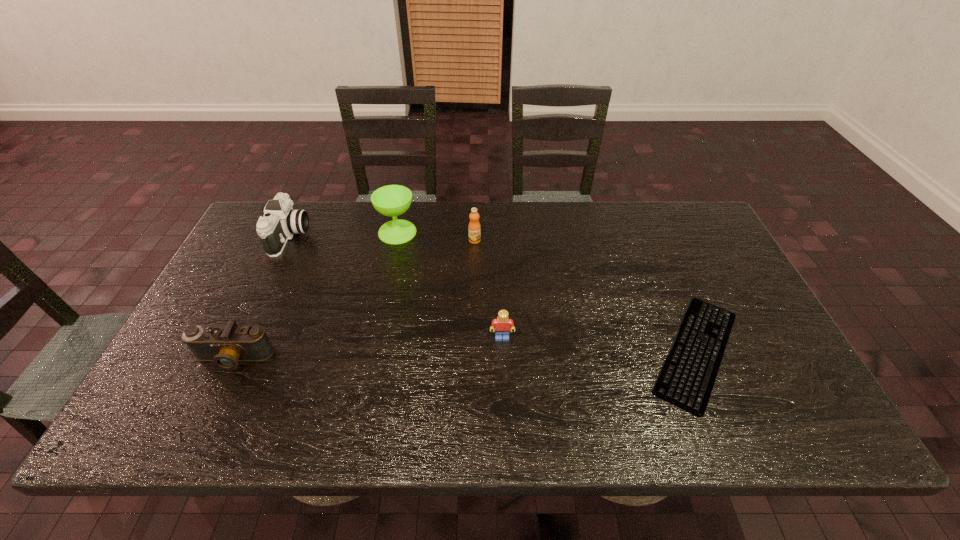
I want to click on vacant region located 0.230m on the front-facing side of the second object from right to left, so click(x=506, y=429).

This screenshot has width=960, height=540. I want to click on free spot located 0.080m on the lens of the nearer camera, so click(211, 406).

Locate an element on the screen. The width and height of the screenshot is (960, 540). vacant space positioned on the back of the rightmost object is located at coordinates (641, 220).

This screenshot has width=960, height=540. I want to click on wineglass situated at the far edge, so click(x=392, y=200).

Where is `camera present at the far edge`? This screenshot has height=540, width=960. camera present at the far edge is located at coordinates (280, 221).

Locate an element on the screen. This screenshot has height=540, width=960. orange juice that is positioned at the far edge is located at coordinates (474, 228).

Locate an element on the screen. object present at the near edge is located at coordinates (687, 378).

Where is `object at the right edge`? object at the right edge is located at coordinates (687, 378).

The image size is (960, 540). Identify the location of object that is at the far left corner. click(280, 221).

Locate an element on the screen. object at the near right corner is located at coordinates pyautogui.click(x=687, y=378).